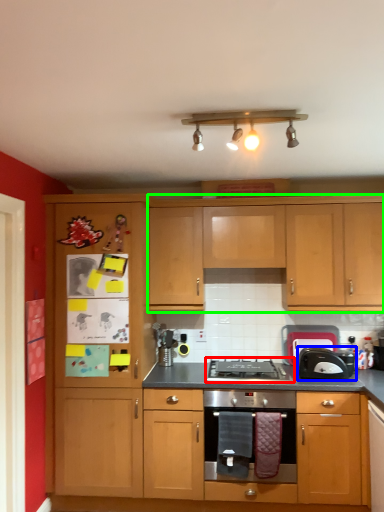
Question: Considering the real-world distances, which object is closest to gas stove (highlighted by a red box)? toaster (highlighted by a blue box) or cabinetry (highlighted by a green box).

Choices:
 (A) toaster
 (B) cabinetry

Answer: (A)